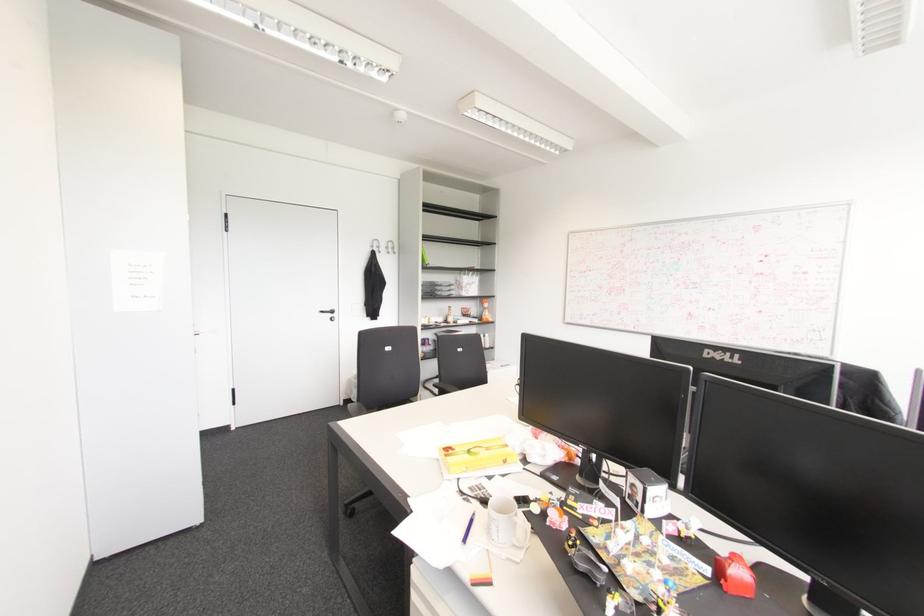
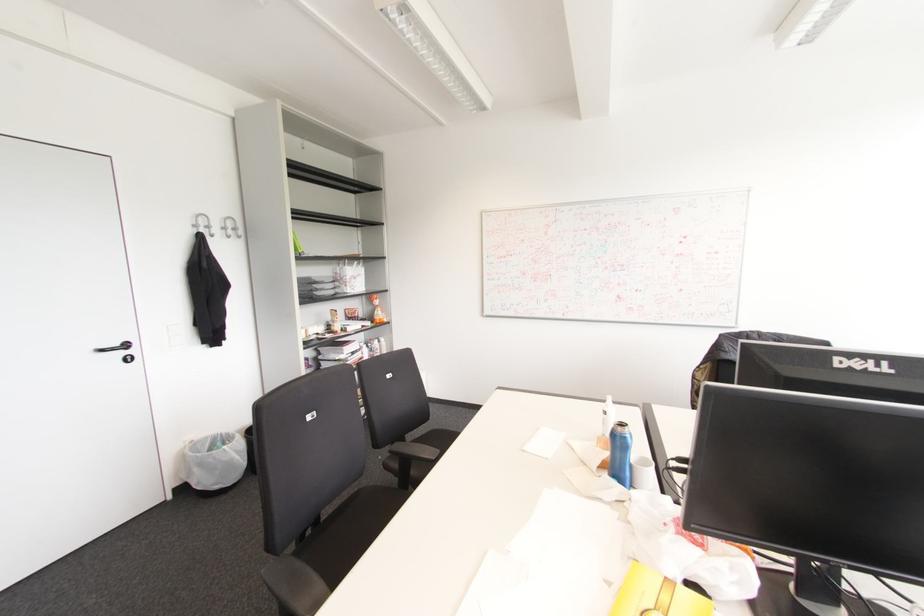
The point at (392,248) is marked in the first image. Where is the corresponding point in the second image?

(234, 229)